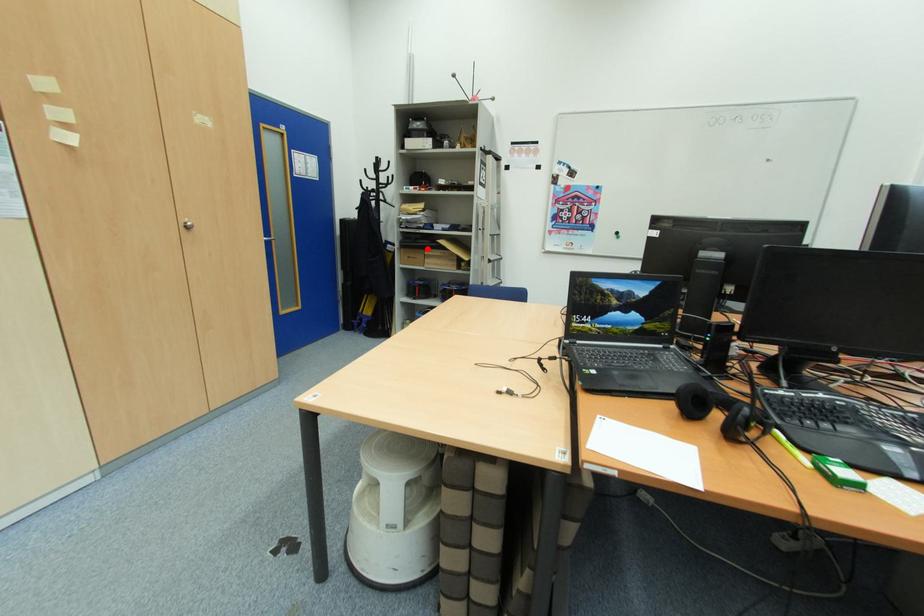
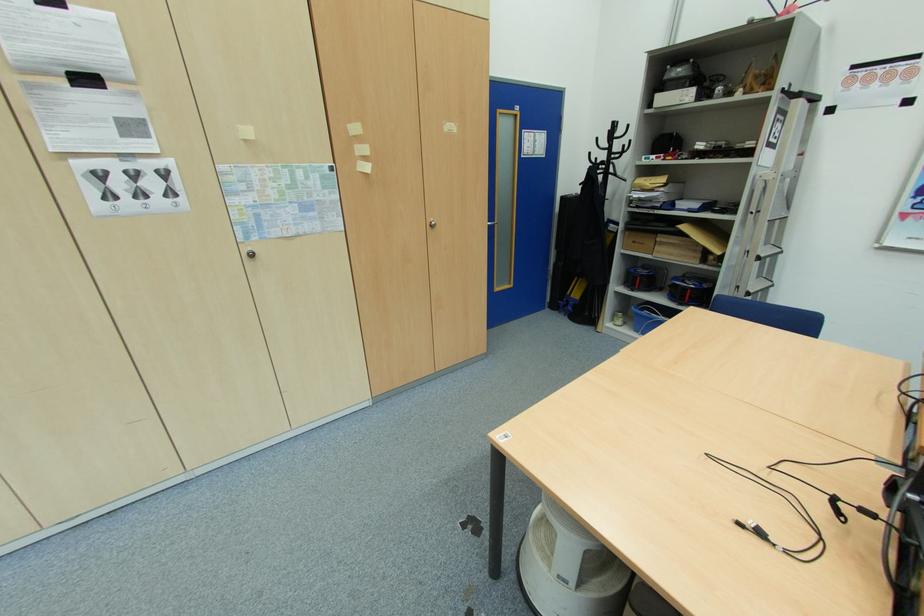
In the second image, find the point that corresponds to the highlighted location in the first image.

(660, 233)